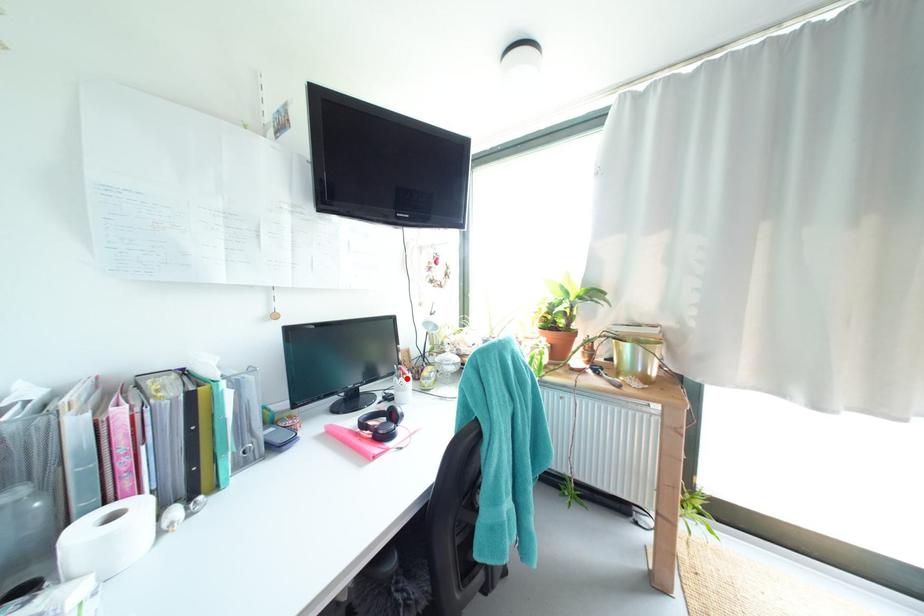
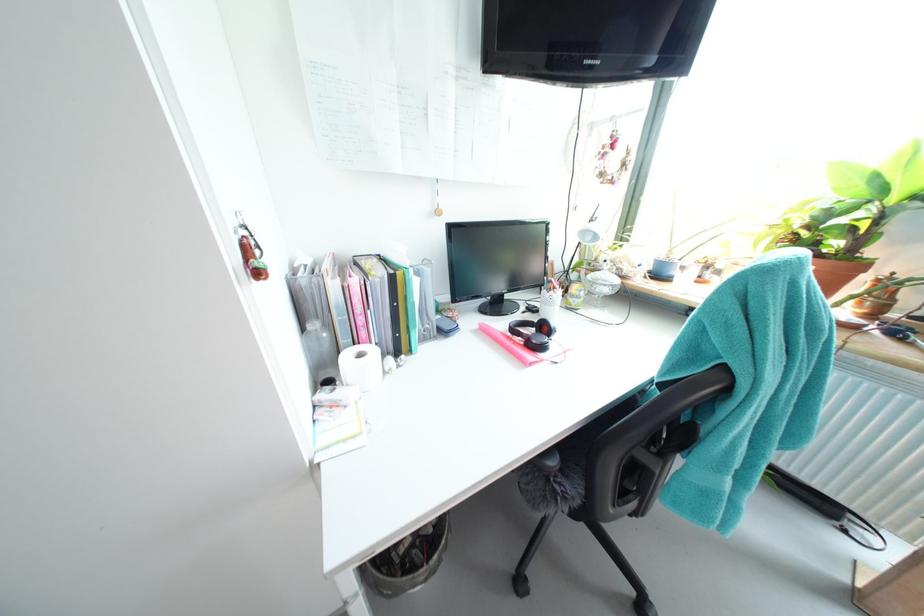
Question: I am providing you with two images of the same scene from different viewpoints. Image1 has a red point marked. In image2, the corresponding 3D location appears at what relative position? Reply with the corresponding letter.

Choices:
 (A) Closer
 (B) Farther

Answer: (A)